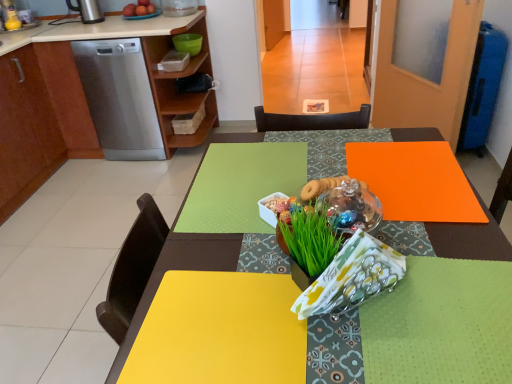
Question: Is satin silver dishwasher at left to the right of green leafy grass at center from the viewer's perspective?

Choices:
 (A) yes
 (B) no

Answer: (B)

Question: Does satin silver dishwasher at left lie in front of green leafy grass at center?

Choices:
 (A) yes
 (B) no

Answer: (B)

Question: Is satin silver dishwasher at left aimed at green leafy grass at center?

Choices:
 (A) yes
 (B) no

Answer: (B)

Question: Are satin silver dishwasher at left and green leafy grass at center beside each other?

Choices:
 (A) yes
 (B) no

Answer: (B)

Question: Would you consider satin silver dishwasher at left to be distant from green leafy grass at center?

Choices:
 (A) no
 (B) yes

Answer: (B)

Question: Relative to matte wood cabinet at left, which is counted as the second cabinetry, starting from the left, is satin silver dishwasher at left in front or behind?

Choices:
 (A) behind
 (B) front

Answer: (A)

Question: From a real-world perspective, is satin silver dishwasher at left above or below matte wood cabinet at left, the 1th cabinetry in the right-to-left sequence?

Choices:
 (A) above
 (B) below

Answer: (B)

Question: Considering the positions of point (139, 84) and point (46, 29), is point (139, 84) closer or farther from the camera than point (46, 29)?

Choices:
 (A) farther
 (B) closer

Answer: (B)

Question: From the image's perspective, is satin silver dishwasher at left located above or below matte wood cabinet at left, which is counted as the second cabinetry, starting from the left?

Choices:
 (A) below
 (B) above

Answer: (B)

Question: Is point (472, 249) positioned closer to the camera than point (325, 251)?

Choices:
 (A) farther
 (B) closer

Answer: (A)

Question: Visually, is yellow matte placemat at center positioned to the left or to the right of green leafy grass at center?

Choices:
 (A) left
 (B) right

Answer: (B)

Question: From a real-world perspective, is yellow matte placemat at center physically located above or below green leafy grass at center?

Choices:
 (A) below
 (B) above

Answer: (A)

Question: Is yellow matte placemat at center inside or outside of green leafy grass at center?

Choices:
 (A) outside
 (B) inside

Answer: (A)

Question: Considering the positions of point (431, 241) and point (82, 21), is point (431, 241) closer or farther from the camera than point (82, 21)?

Choices:
 (A) farther
 (B) closer

Answer: (B)

Question: Considering their positions, is yellow matte placemat at center located in front of or behind metallic stainless steel kettle at upper left?

Choices:
 (A) front
 (B) behind

Answer: (A)